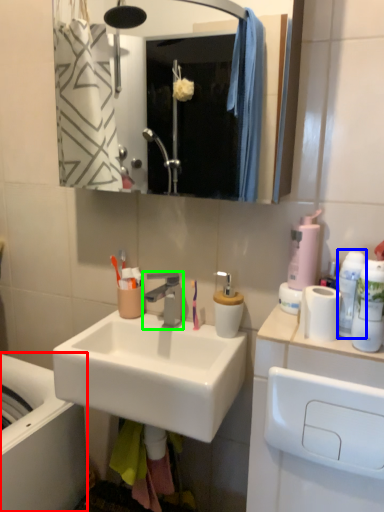
Question: Which object is positioned closest to bath (highlighted by a red box)? Select from mouthwash (highlighted by a blue box) and tap (highlighted by a green box).

Choices:
 (A) mouthwash
 (B) tap

Answer: (B)